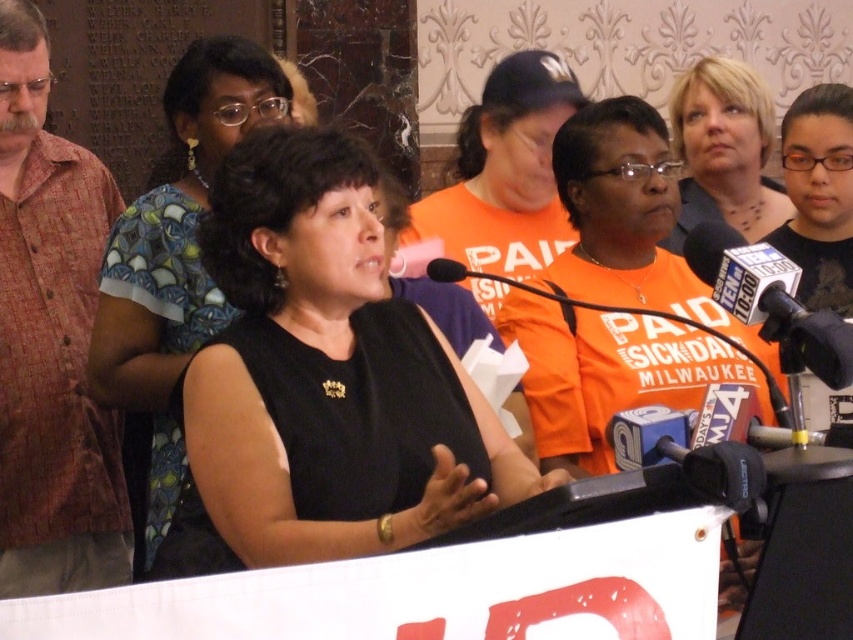
Question: Which of the following is the closest to the observer?

Choices:
 (A) orange cotton shirt at center
 (B) black fabric shirt at center
 (C) blonde hair at upper right

Answer: (B)

Question: Does black fabric at center appear under orange cotton shirt at center?

Choices:
 (A) no
 (B) yes

Answer: (B)

Question: Which is nearer to the blonde hair at upper right?

Choices:
 (A) orange cotton shirt at center
 (B) metallic silver microphone at center right
 (C) black fabric at center

Answer: (A)

Question: Is orange cotton shirt at center to the left of black fabric shirt at center from the viewer's perspective?

Choices:
 (A) no
 (B) yes

Answer: (A)

Question: Is reddish-brown button-up shirt at left wider than orange cotton shirt at center?

Choices:
 (A) no
 (B) yes

Answer: (B)

Question: Based on their relative distances, which object is farther from the reddish-brown button-up shirt at left?

Choices:
 (A) metallic silver microphone at center right
 (B) black fabric shirt at center

Answer: (A)